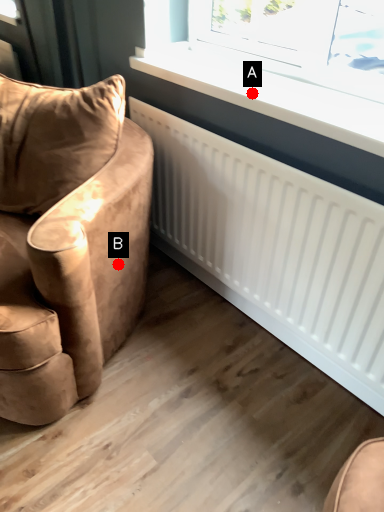
Question: Two points are circled on the image, labeled by A and B beside each circle. Which of the following is the farthest from the observer?

Choices:
 (A) A is further
 (B) B is further

Answer: (B)